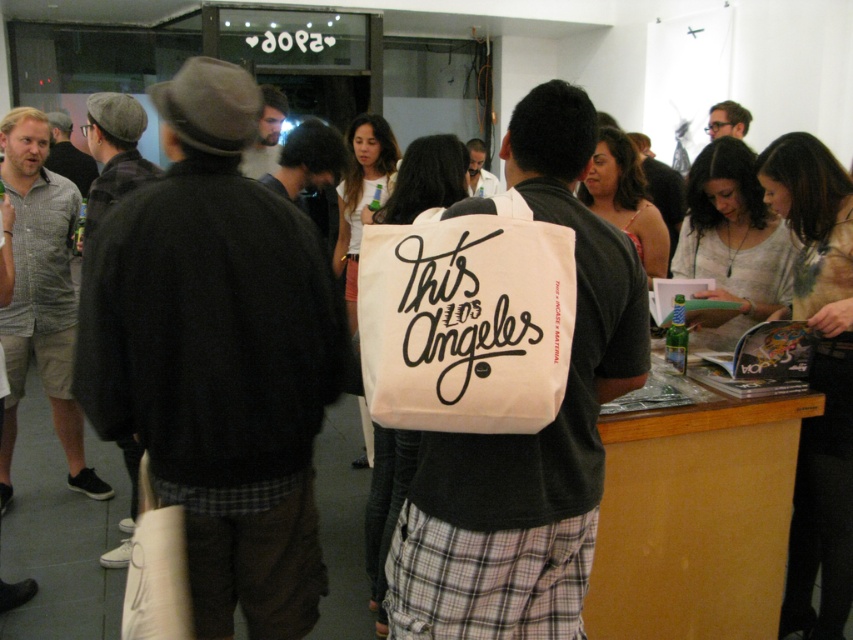
Does white canvas tote bag at center have a greater width compared to light beige shirt at center?

Yes, white canvas tote bag at center is wider than light beige shirt at center.

Which of these two, white canvas tote bag at center or light beige shirt at center, stands shorter?

Standing shorter between the two is light beige shirt at center.

Does point (421, 598) come farther from viewer compared to point (467, 180)?

No, (421, 598) is in front of (467, 180).

Identify the location of white canvas tote bag at center. (527, 435).

From the picture: Is checkered cotton shirt at left shorter than bearded man at center?

No, checkered cotton shirt at left is not shorter than bearded man at center.

Which is more to the right, checkered cotton shirt at left or bearded man at center?

bearded man at center is more to the right.

The image size is (853, 640). Describe the element at coordinates (41, 294) in the screenshot. I see `checkered cotton shirt at left` at that location.

Where is `checkered cotton shirt at left`? checkered cotton shirt at left is located at coordinates [41, 294].

Which is above, white canvas tote bag at center or bearded man at center?

bearded man at center is higher up.

Image resolution: width=853 pixels, height=640 pixels. Identify the location of white canvas tote bag at center. (527, 435).

You are a GUI agent. You are given a task and a screenshot of the screen. Output one action in this format:
    pyautogui.click(x=<x>, y=<y>)
    Task: Click on the white canvas tote bag at center
    This screenshot has height=640, width=853.
    Given the screenshot: What is the action you would take?
    (527, 435)

The image size is (853, 640). Identify the location of white canvas tote bag at center. (527, 435).